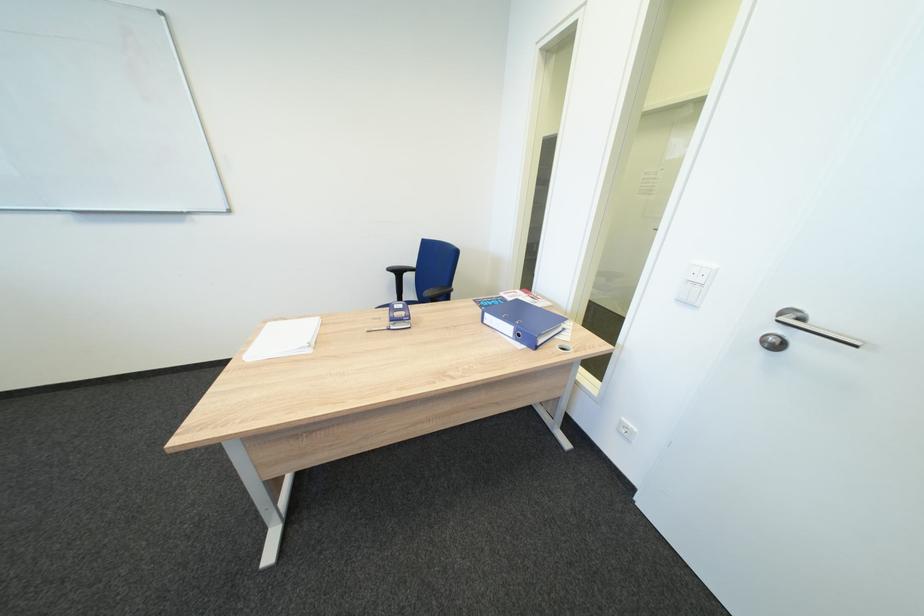
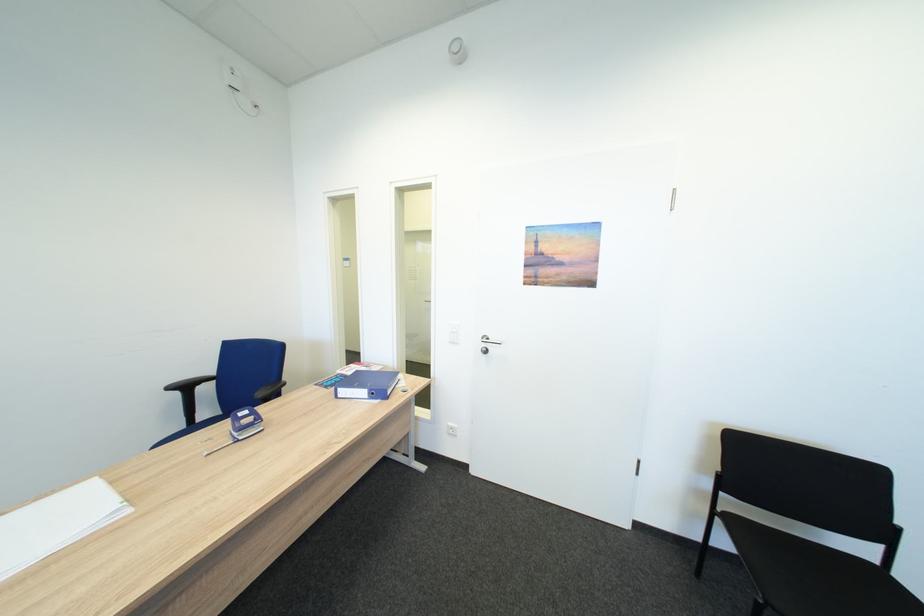
Question: The camera is either moving clockwise (left) or counter-clockwise (right) around the object. The first image is from the beginning of the video and the second image is from the end. Is the camera moving left or right when shooting the video?

Choices:
 (A) Left
 (B) Right

Answer: (A)